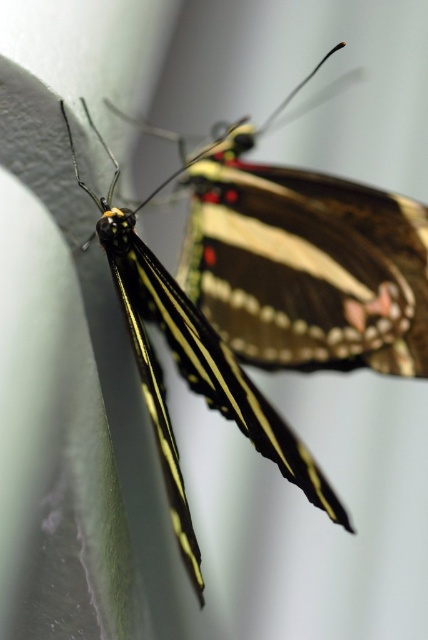
Question: Does shiny brown butterfly at upper center have a greater width compared to shiny black butterfly at center?

Choices:
 (A) yes
 (B) no

Answer: (A)

Question: Does shiny brown butterfly at upper center have a smaller size compared to shiny black butterfly at center?

Choices:
 (A) yes
 (B) no

Answer: (A)

Question: Which object is closer to the camera taking this photo?

Choices:
 (A) shiny black butterfly at center
 (B) shiny brown butterfly at upper center

Answer: (A)

Question: Which object appears closest to the camera in this image?

Choices:
 (A) shiny black butterfly at center
 (B) shiny brown butterfly at upper center

Answer: (A)

Question: Is shiny brown butterfly at upper center smaller than shiny black butterfly at center?

Choices:
 (A) yes
 (B) no

Answer: (A)